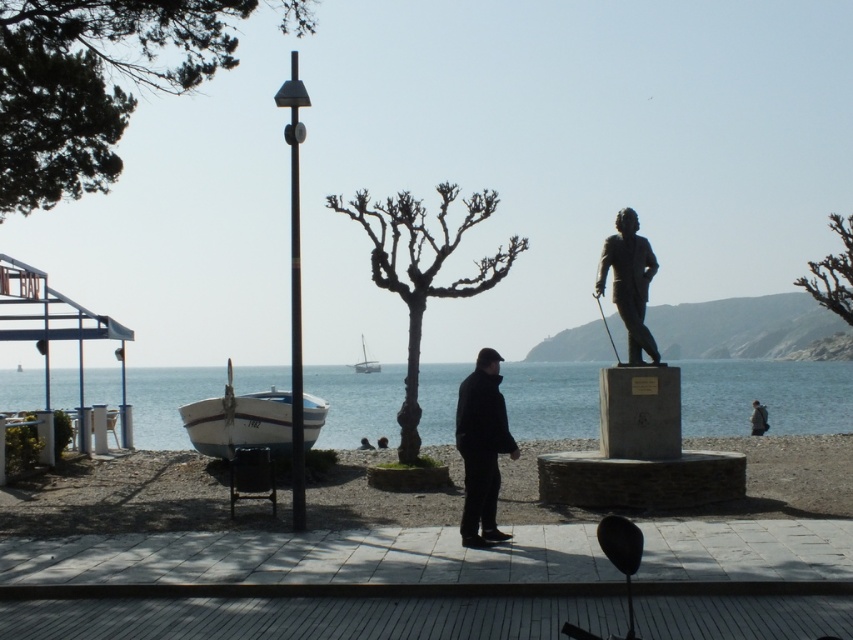
Question: Does black matte jacket at center have a smaller size compared to matte black pole at center?

Choices:
 (A) no
 (B) yes

Answer: (B)

Question: Which object is positioned closest to the blue water at center?

Choices:
 (A) bronze statue at right
 (B) white plastic boat at center
 (C) black matte jacket at center

Answer: (B)

Question: Which object is closer to the camera taking this photo?

Choices:
 (A) bare branches at upper right
 (B) brown fur coat at center
 (C) white glossy boat at lower left

Answer: (C)

Question: Is bare branches at upper right to the left of white plastic boat at center from the viewer's perspective?

Choices:
 (A) yes
 (B) no

Answer: (B)

Question: Does smooth sand at lower center appear under blue water at center?

Choices:
 (A) yes
 (B) no

Answer: (B)

Question: Estimate the real-world distances between objects in this image. Which object is farther from the brown fur coat at center?

Choices:
 (A) black matte jacket at center
 (B) bare branches at center
 (C) bare branches at upper right
 (D) smooth sand at lower center

Answer: (A)